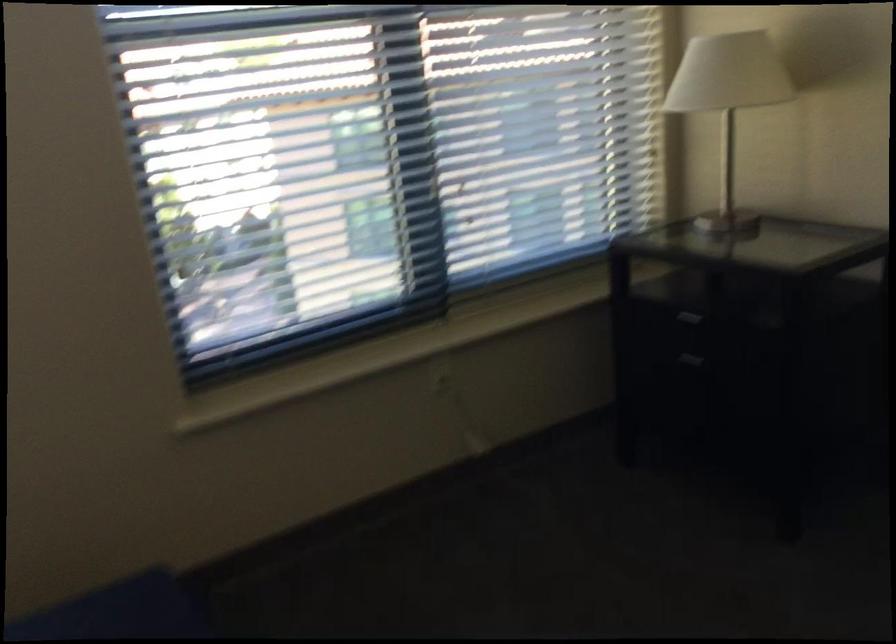
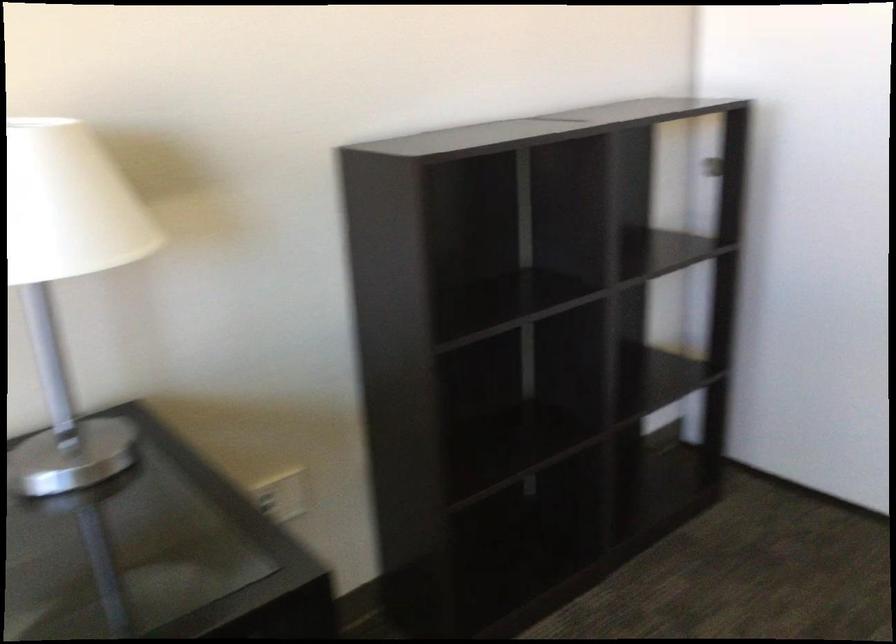
Question: The first image is from the beginning of the video and the second image is from the end. How did the camera likely rotate when shooting the video?

Choices:
 (A) Left
 (B) Right
 (C) Up
 (D) Down

Answer: (B)